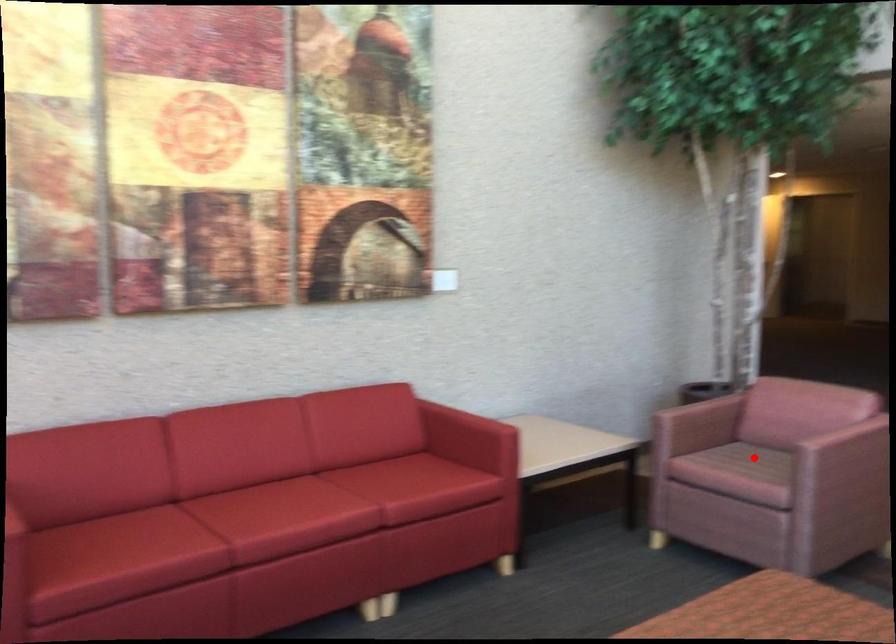
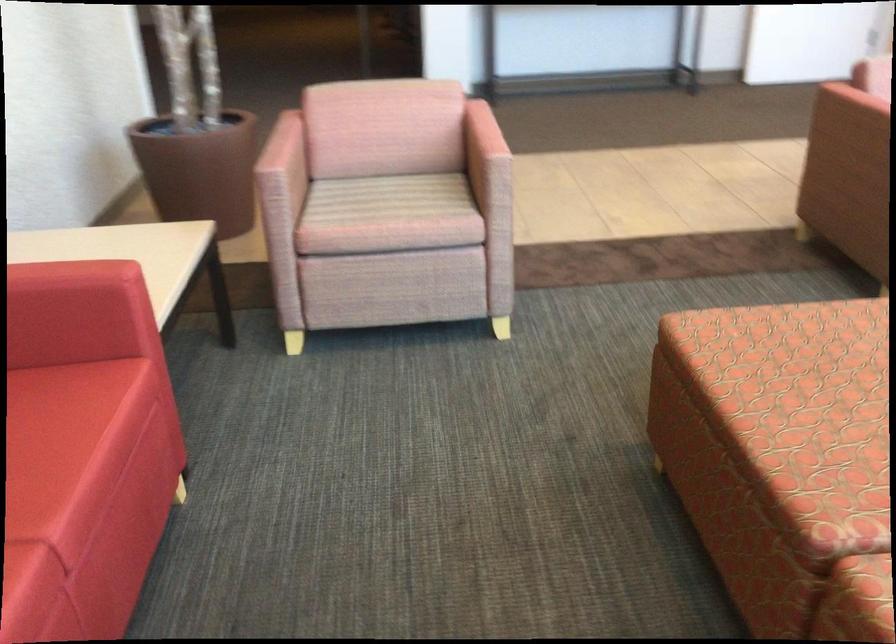
Locate, in the second image, the point that corresponds to the highlighted location in the first image.

(389, 198)